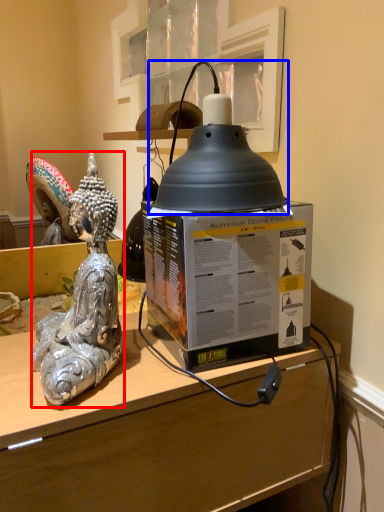
Question: Which point is further to the camera, figurine (highlighted by a red box) or oil lamp (highlighted by a blue box)?

Choices:
 (A) figurine
 (B) oil lamp

Answer: (B)